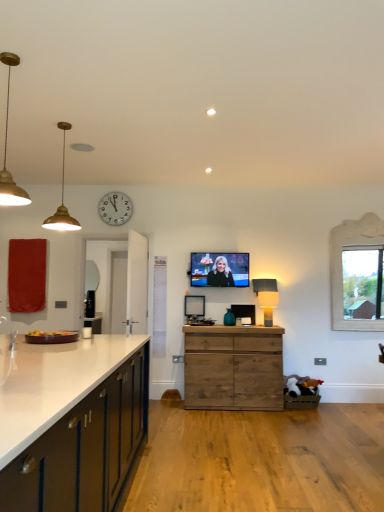
What is the approximate width of matte black tv at center, which is counted as the third picture frame, starting from the bottom?

It is 4.10 inches.

Describe the element at coordinates (194, 306) in the screenshot. I see `wooden picture frame at center, placed as the second picture frame when sorted from top to bottom` at that location.

In order to face red fabric curtain at left, should I rotate leftwards or rightwards?

You should rotate left by 21.069 degrees.

Identify the location of matte black picture frame at center, which ranks as the 3th picture frame in top-to-bottom order. (244, 311).

How different are the orientations of gold metallic pendant light at left, which is the third lamp in back-to-front order, and white carved wood window at right in degrees?

92.9 degrees separate the facing orientations of gold metallic pendant light at left, which is the third lamp in back-to-front order, and white carved wood window at right.

From the image's perspective, which is above, gold metallic pendant light at left, marked as the first lamp in a left-to-right arrangement, or white carved wood window at right?

gold metallic pendant light at left, marked as the first lamp in a left-to-right arrangement, appears higher in the image.

Can you see gold metallic pendant light at left, which is the third lamp in back-to-front order, touching white carved wood window at right?

No.

Which of these two, gold metallic pendant light at left, which appears as the third lamp when ordered from the bottom, or white carved wood window at right, is thinner?

white carved wood window at right.

In the image, is wooden picture frame at center, positioned as the second picture frame in bottom-to-top order, on the left side or the right side of matte black tv at center, which is counted as the third picture frame, starting from the bottom?

Based on their positions, wooden picture frame at center, positioned as the second picture frame in bottom-to-top order, is located to the left of matte black tv at center, which is counted as the third picture frame, starting from the bottom.

From a real-world perspective, is wooden picture frame at center, placed as the second picture frame when sorted from top to bottom, physically below matte black tv at center, which is counted as the third picture frame, starting from the bottom?

Yes.

The height and width of the screenshot is (512, 384). I want to click on the 1st cabinetry below the red fabric curtain at left (from the image's perspective), so click(x=84, y=446).

Is red fabric curtain at left further to the viewer compared to white glossy cabinet at left, the 1th cabinetry positioned from the left?

Yes, red fabric curtain at left is further from the camera.

Considering the relative sizes of red fabric curtain at left and white glossy cabinet at left, marked as the first cabinetry in a front-to-back arrangement, in the image provided, is red fabric curtain at left smaller than white glossy cabinet at left, marked as the first cabinetry in a front-to-back arrangement,?

→ Yes, red fabric curtain at left is smaller than white glossy cabinet at left, marked as the first cabinetry in a front-to-back arrangement.

Considering the relative sizes of wooden picture frame at center, placed as the second picture frame when sorted from top to bottom, and natural wood cabinet at center, arranged as the 2th cabinetry when viewed from the front, in the image provided, is wooden picture frame at center, placed as the second picture frame when sorted from top to bottom, bigger than natural wood cabinet at center, arranged as the 2th cabinetry when viewed from the front,?

Incorrect, wooden picture frame at center, placed as the second picture frame when sorted from top to bottom, is not larger than natural wood cabinet at center, arranged as the 2th cabinetry when viewed from the front.

Is wooden picture frame at center, positioned as the second picture frame in bottom-to-top order, turned away from natural wood cabinet at center, which ranks as the 1th cabinetry in right-to-left order?

No, wooden picture frame at center, positioned as the second picture frame in bottom-to-top order,'s orientation is not away from natural wood cabinet at center, which ranks as the 1th cabinetry in right-to-left order.

Which of these two, wooden picture frame at center, placed as the second picture frame when sorted from top to bottom, or natural wood cabinet at center, acting as the second cabinetry starting from the left, stands shorter?

Standing shorter between the two is wooden picture frame at center, placed as the second picture frame when sorted from top to bottom.

Does wooden picture frame at center, positioned as the second picture frame in bottom-to-top order, contain natural wood cabinet at center, arranged as the 2th cabinetry when viewed from the front?

No.

Can you confirm if wooden picture frame at center, positioned as the second picture frame in bottom-to-top order, is shorter than gold matte pendant light at upper left, acting as the 2th lamp starting from the bottom?

Yes, wooden picture frame at center, positioned as the second picture frame in bottom-to-top order, is shorter than gold matte pendant light at upper left, acting as the 2th lamp starting from the bottom.

In terms of width, does wooden picture frame at center, placed as the second picture frame when sorted from top to bottom, look wider or thinner when compared to gold matte pendant light at upper left, the second lamp positioned from the front?

Considering their sizes, wooden picture frame at center, placed as the second picture frame when sorted from top to bottom, looks slimmer than gold matte pendant light at upper left, the second lamp positioned from the front.

From the image's perspective, which one is positioned higher, wooden picture frame at center, placed as the second picture frame when sorted from top to bottom, or gold matte pendant light at upper left, the second lamp positioned from the front?

gold matte pendant light at upper left, the second lamp positioned from the front, is shown above in the image.

Looking at this image, from the image's perspective, is white wooden clock at upper center located above or below white carved wood window at right?

Clearly, from the image's perspective, white wooden clock at upper center is above white carved wood window at right.

Is white wooden clock at upper center positioned beyond the bounds of white carved wood window at right?

white wooden clock at upper center is positioned outside white carved wood window at right.

Find the location of a particular element. This screenshot has height=512, width=384. window below the white wooden clock at upper center (from the image's perspective) is located at coordinates (357, 274).

Is white wooden clock at upper center oriented towards white carved wood window at right?

No, white wooden clock at upper center is not turned towards white carved wood window at right.

Considering the points (62, 206) and (114, 459), which point is behind, point (62, 206) or point (114, 459)?

The point (62, 206) is more distant.

Based on the photo, which of these two, gold matte pendant light at upper left, the second lamp positioned from the front, or white glossy cabinet at left, marked as the first cabinetry in a front-to-back arrangement, is wider?

white glossy cabinet at left, marked as the first cabinetry in a front-to-back arrangement.

Would you say gold matte pendant light at upper left, the second lamp when ordered from right to left, is a long distance from white glossy cabinet at left, the second cabinetry in the back-to-front sequence?

That's right, there is a large distance between gold matte pendant light at upper left, the second lamp when ordered from right to left, and white glossy cabinet at left, the second cabinetry in the back-to-front sequence.

I want to click on window behind the gold metallic pendant light at left, which appears as the third lamp when ordered from the bottom, so click(357, 274).

Find the location of a particular element. The height and width of the screenshot is (512, 384). the 1st picture frame located beneath the matte black tv at center, which is counted as the third picture frame, starting from the bottom (from a real-world perspective) is located at coordinates (194, 306).

Considering their positions, is white glossy cabinet at left, marked as the first cabinetry in a front-to-back arrangement, positioned closer to white wooden clock at upper center than gold matte pendant light at upper left, the second lamp positioned from the front?

Among the two, gold matte pendant light at upper left, the second lamp positioned from the front, is located nearer to white wooden clock at upper center.

Which object lies nearer to the anchor point wooden picture frame at center, placed as the second picture frame when sorted from top to bottom, natural wood cabinet at center, which is the first cabinetry from back to front, or white carved wood window at right?

natural wood cabinet at center, which is the first cabinetry from back to front, is closer to wooden picture frame at center, placed as the second picture frame when sorted from top to bottom.

Based on their spatial positions, is white carved wood window at right or matte black tv at center, positioned as the 1th picture frame in top-to-bottom order, further from gold metallic pendant light at left, which is the third lamp in back-to-front order?

white carved wood window at right is further to gold metallic pendant light at left, which is the third lamp in back-to-front order.

Which object lies nearer to the anchor point white carved wood window at right, natural wood cabinet at center, acting as the second cabinetry starting from the left, or matte black picture frame at center, which ranks as the 3th picture frame in top-to-bottom order?

matte black picture frame at center, which ranks as the 3th picture frame in top-to-bottom order, lies closer to white carved wood window at right than the other object.

Looking at the image, which one is located closer to natural wood cabinet at center, arranged as the 2th cabinetry when viewed from the front, matte silver mirror at left or gold metallic pendant light at left, the third lamp from the right?

matte silver mirror at left lies closer to natural wood cabinet at center, arranged as the 2th cabinetry when viewed from the front, than the other object.

Looking at the image, which one is located further to red fabric curtain at left, matte silver mirror at left or gold matte pendant light at upper left, the second lamp positioned from the front?

matte silver mirror at left is positioned further to the anchor red fabric curtain at left.

From the image, which object appears to be farther from matte black tv at center, which is counted as the third picture frame, starting from the bottom, matte black lamp at center, the 1th lamp from the right, or matte silver mirror at left?

Among the two, matte silver mirror at left is located further to matte black tv at center, which is counted as the third picture frame, starting from the bottom.

When comparing their distances from matte silver mirror at left, does white carved wood window at right or matte black tv at center, which is counted as the third picture frame, starting from the bottom, seem further?

Based on the image, white carved wood window at right appears to be further to matte silver mirror at left.

I want to click on lamp located between wooden picture frame at center, positioned as the second picture frame in bottom-to-top order, and white carved wood window at right in the left-right direction, so click(266, 297).

At what (x,y) coordinates should I click in order to perform the action: click on cabinetry between gold metallic pendant light at left, marked as the first lamp in a left-to-right arrangement, and matte black tv at center, positioned as the 1th picture frame in top-to-bottom order, in the front-back direction. Please return your answer as a coordinate pair (x, y). The width and height of the screenshot is (384, 512). Looking at the image, I should click on [233, 368].

This screenshot has height=512, width=384. Find the location of `clock situated between red fabric curtain at left and natural wood cabinet at center, acting as the second cabinetry starting from the left, from left to right`. clock situated between red fabric curtain at left and natural wood cabinet at center, acting as the second cabinetry starting from the left, from left to right is located at coordinates (115, 208).

What are the coordinates of `clock between white glossy cabinet at left, marked as the first cabinetry in a front-to-back arrangement, and matte silver mirror at left in the front-back direction` in the screenshot? It's located at (x=115, y=208).